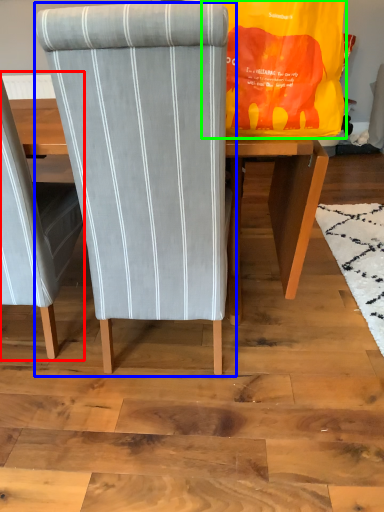
Question: Based on their relative distances, which object is nearer to chair (highlighted by a red box)? Choose from chair (highlighted by a blue box) and bag (highlighted by a green box).

Choices:
 (A) chair
 (B) bag

Answer: (A)